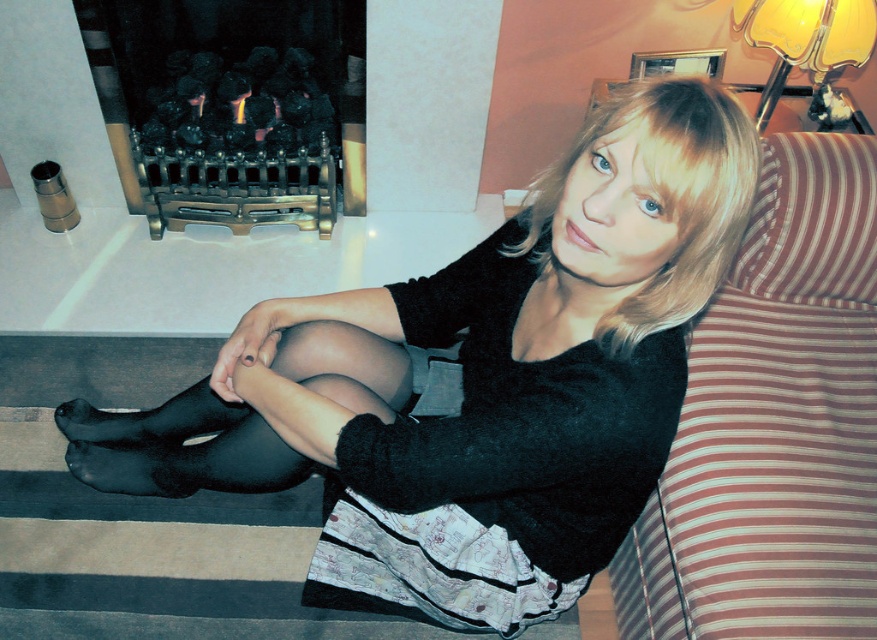
You are a photographer setting up a shoot in this cozy room. You need to position a small tripod between the matte black tights at lower left and the striped fabric couch at right. Based on their positions, where should you place the tripod?

The tripod should be placed between the matte black tights at lower left and the striped fabric couch at right, as the matte black tights at lower left is located below the striped fabric couch at right, creating a vertical space where the tripod can be positioned.